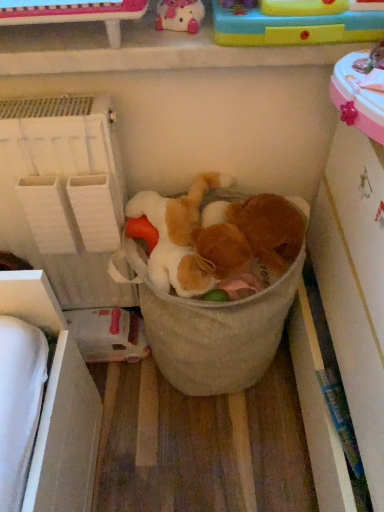
Question: In terms of size, does rubberized plastic toy at upper right, which is the 2th toy from top to bottom, appear bigger or smaller than beige fabric laundry basket at center?

Choices:
 (A) small
 (B) big

Answer: (A)

Question: Considering the positions of rubberized plastic toy at upper right, which ranks as the second toy in bottom-to-top order, and beige fabric laundry basket at center in the image, is rubberized plastic toy at upper right, which ranks as the second toy in bottom-to-top order, wider or thinner than beige fabric laundry basket at center?

Choices:
 (A) wide
 (B) thin

Answer: (B)

Question: Which object is the farthest from the fluffy brown teddy bear at center?

Choices:
 (A) rubberized plastic toy at upper right, which is the 2th toy from top to bottom
 (B) matte pink plush at upper center, marked as the 1th toy in a top-to-bottom arrangement
 (C) fluffy white teddy bear at center, the 1th toy ordered from the bottom
 (D) white fabric shelf at left
 (E) beige fabric laundry basket at center

Answer: (B)

Question: Which of these objects is positioned farthest from the white fabric shelf at left?

Choices:
 (A) beige fabric laundry basket at center
 (B) matte pink plush at upper center, marked as the 1th toy in a top-to-bottom arrangement
 (C) rubberized plastic toy at upper right, which ranks as the second toy in bottom-to-top order
 (D) fluffy brown teddy bear at center
 (E) fluffy white teddy bear at center, the 1th toy ordered from the bottom

Answer: (C)